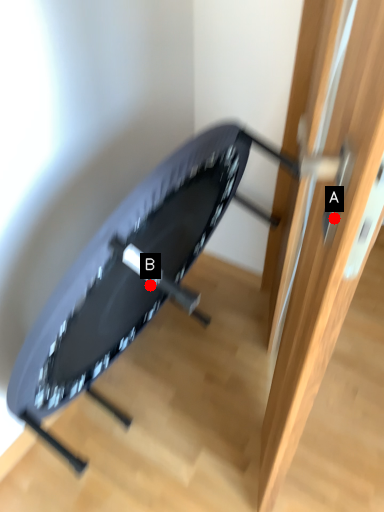
Question: Two points are circled on the image, labeled by A and B beside each circle. Which of the following is the farthest from the observer?

Choices:
 (A) A is further
 (B) B is further

Answer: (B)